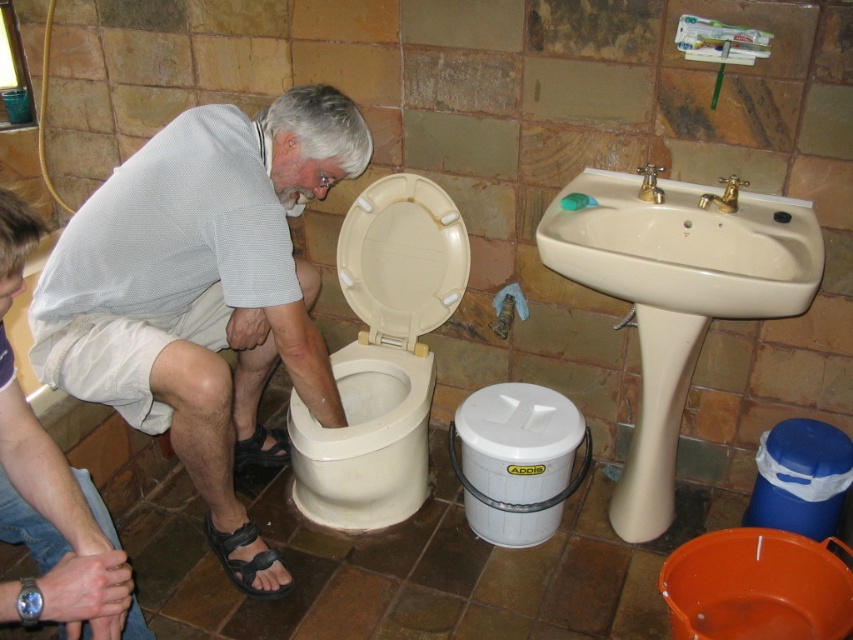
Question: Can you confirm if white mesh shirt at center is positioned below beige ceramic sink at upper center?

Choices:
 (A) yes
 (B) no

Answer: (B)

Question: Which object is positioned closest to the beige plastic toilet seat at center?

Choices:
 (A) beige ceramic sink at upper center
 (B) white glossy toilet bowl at center
 (C) gold metallic faucet at upper right
 (D) white mesh shirt at lower left

Answer: (B)

Question: Among these points, which one is farthest from the camera?

Choices:
 (A) (241, 264)
 (B) (769, 244)
 (C) (646, 170)

Answer: (C)

Question: Is white mesh shirt at center positioned at the back of white glossy toilet bowl at center?

Choices:
 (A) yes
 (B) no

Answer: (B)

Question: Which object appears closest to the camera in this image?

Choices:
 (A) white mesh shirt at center
 (B) black leather sandal at lower left
 (C) gold metallic faucet at upper center
 (D) white glossy toilet bowl at center

Answer: (A)

Question: From the image, what is the correct spatial relationship of beige plastic toilet seat at center in relation to black leather sandal at lower left?

Choices:
 (A) left
 (B) right

Answer: (B)